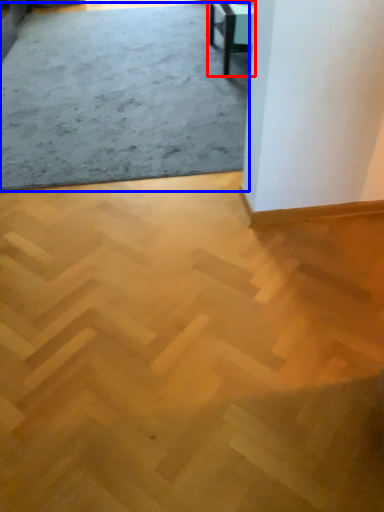
Question: Among these objects, which one is nearest to the camera, table (highlighted by a red box) or concrete (highlighted by a blue box)?

Choices:
 (A) table
 (B) concrete

Answer: (B)